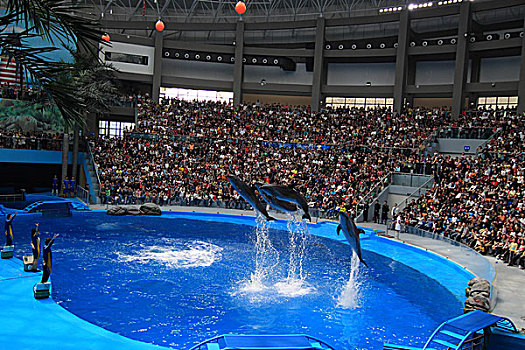
This screenshot has height=350, width=525. Find the location of `windows`. windows is located at coordinates (485, 97), (367, 101), (198, 93), (112, 132).